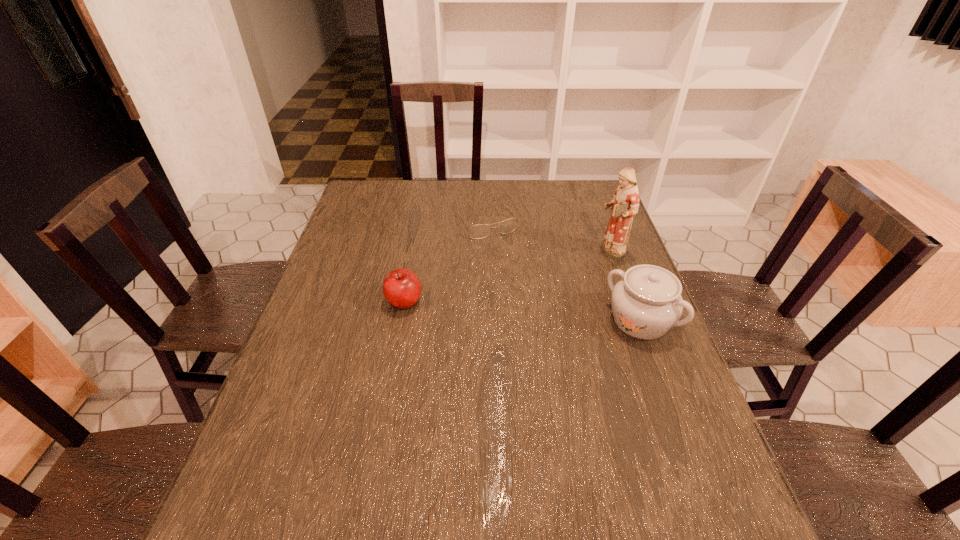
In order to click on free space located 0.160m on the front-facing side of the tallest object in this screenshot , I will do (x=559, y=276).

Identify the location of vacant space positioned 0.080m on the front-facing side of the tallest object. The height and width of the screenshot is (540, 960). (580, 267).

Find the location of `free space located on the front-facing side of the shortest object`. free space located on the front-facing side of the shortest object is located at coordinates (551, 326).

I want to click on blank space located 0.260m on the front-facing side of the shortest object, so click(529, 291).

Locate an element on the screen. This screenshot has width=960, height=540. blank space located 0.190m on the front-facing side of the shortest object is located at coordinates (519, 275).

The image size is (960, 540). In order to click on object that is at the far edge in this screenshot , I will do `click(480, 231)`.

Find the location of a particular element. Image resolution: width=960 pixels, height=540 pixels. chinaware at the right edge is located at coordinates (646, 303).

Find the location of a particular element. This screenshot has height=540, width=960. figurine located at the right edge is located at coordinates (625, 203).

Find the location of a particular element. The image size is (960, 540). free space at the far edge of the desktop is located at coordinates (504, 209).

This screenshot has height=540, width=960. In order to click on free space at the near edge of the desktop in this screenshot , I will do `click(394, 453)`.